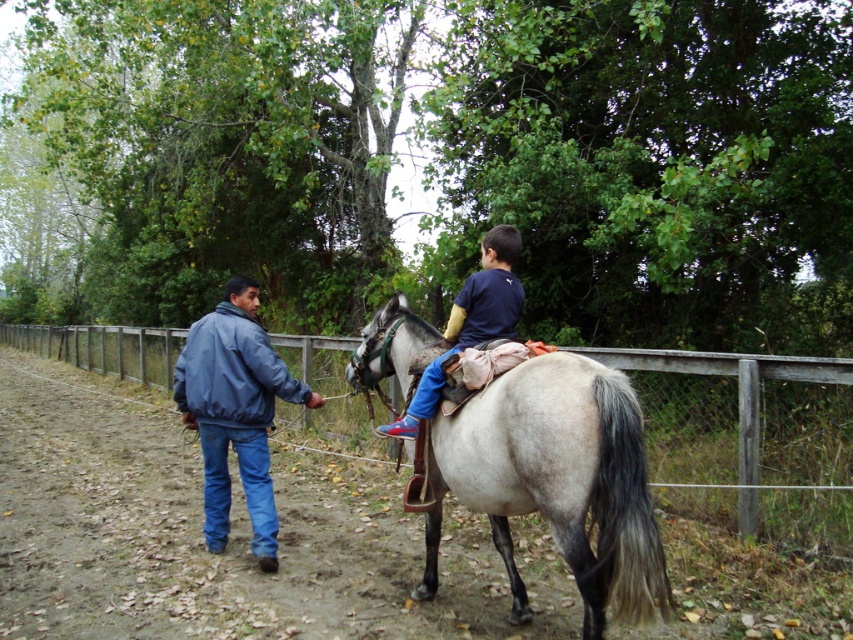
Which of these two, wooden fence at center or blue denim jeans at center, stands shorter?

blue denim jeans at center is shorter.

Consider the image. Is wooden fence at center smaller than blue denim jeans at center?

Incorrect, wooden fence at center is not smaller in size than blue denim jeans at center.

Is point (791, 380) behind point (497, 234)?

Yes, point (791, 380) is farther from viewer.

In order to click on wooden fence at center in this screenshot , I will do `click(747, 440)`.

Does gray matte/suede horse at center appear on the left side of blue denim jacket at left?

In fact, gray matte/suede horse at center is to the right of blue denim jacket at left.

Does point (451, 428) come in front of point (236, 433)?

Yes, it is in front of point (236, 433).

This screenshot has width=853, height=640. Describe the element at coordinates (556, 483) in the screenshot. I see `gray matte/suede horse at center` at that location.

Find the location of a particular element. This screenshot has height=640, width=853. gray matte/suede horse at center is located at coordinates (556, 483).

Consider the image. Measure the distance between wooden fence at center and gray matte/suede horse at center.

The distance of wooden fence at center from gray matte/suede horse at center is 3.74 meters.

Is wooden fence at center to the left of gray matte/suede horse at center from the viewer's perspective?

Indeed, wooden fence at center is positioned on the left side of gray matte/suede horse at center.

Is point (792, 394) farther from viewer compared to point (437, 552)?

Yes, point (792, 394) is behind point (437, 552).

Find the location of a particular element. wooden fence at center is located at coordinates (747, 440).